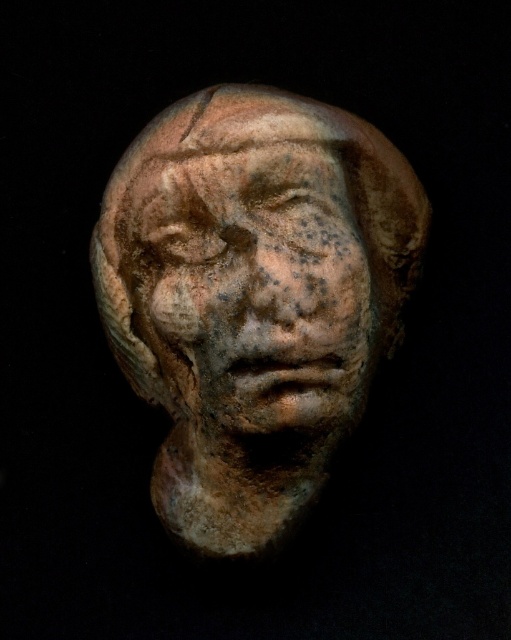
You are an art conservator examining the sculpture. You notice two pieces in the image, the matte clay head at center and the earthenware sculpture at center. Which one is located to the left?

The matte clay head at center is positioned on the left side of earthenware sculpture at center.

You are an archaeologist examining two sculptures in a museum display case. The display case has a divider that allows you to only access one sculpture at a time. You need to clean both the matte clay head at center and the earthenware sculpture at center. Given that your cleaning tool can reach 0.5 inches, can you clean both sculptures without moving the divider?

The matte clay head at center and earthenware sculpture at center are 0.63 inches apart from each other. Since your cleaning tool can only reach 0.5 inches, you cannot clean both sculptures without moving the divider because the distance between them exceeds the tool reach.

Looking at this image, you are an art conservator examining two sculptures in a museum display case. You have a matte clay head at center and an earthenware sculpture at center. Which sculpture is taller?

The matte clay head at center is much taller than the earthenware sculpture at center.